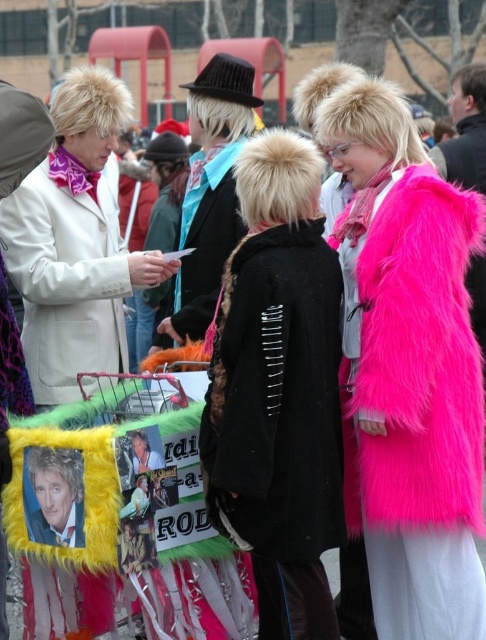
Is point (386, 150) farther from camera compared to point (89, 292)?

That is True.

Can you confirm if fuzzy pink coat at upper right is shorter than white fur coat at left?

Incorrect, fuzzy pink coat at upper right's height does not fall short of white fur coat at left's.

Where is `fuzzy pink coat at upper right`? This screenshot has height=640, width=486. fuzzy pink coat at upper right is located at coordinates (408, 368).

This screenshot has width=486, height=640. In order to click on fuzzy pink coat at upper right in this screenshot , I will do `click(408, 368)`.

Does black fur coat at center have a larger size compared to white fur coat at left?

No, black fur coat at center is not bigger than white fur coat at left.

Can you confirm if black fur coat at center is wider than white fur coat at left?

No.

What do you see at coordinates (277, 396) in the screenshot?
I see `black fur coat at center` at bounding box center [277, 396].

I want to click on black fur coat at center, so click(x=277, y=396).

Which is below, fuzzy pink coat at upper right or black fur coat at center?

Positioned lower is black fur coat at center.

The height and width of the screenshot is (640, 486). I want to click on fuzzy pink coat at upper right, so point(408,368).

Identify the location of fuzzy pink coat at upper right. (408, 368).